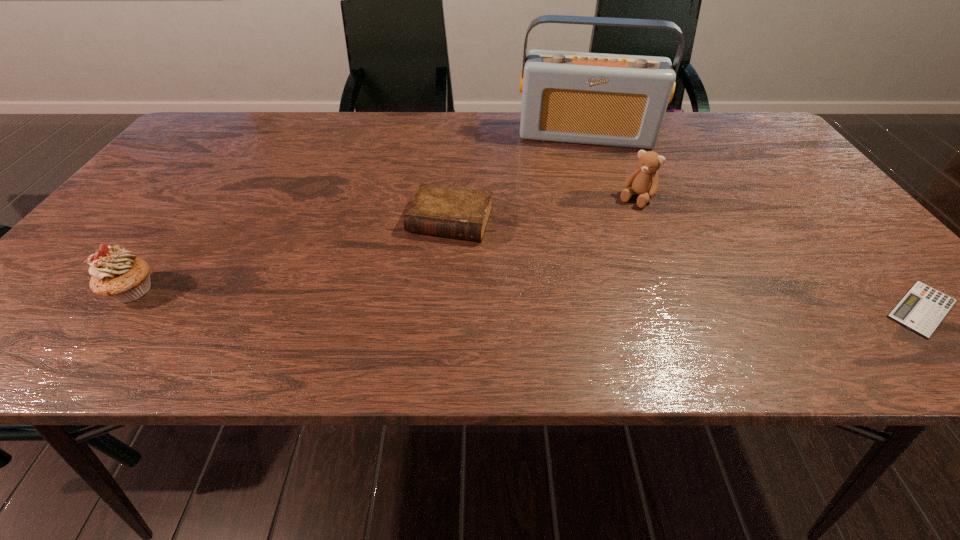
Locate an element on the screen. This screenshot has width=960, height=540. the leftmost object is located at coordinates (117, 273).

Where is `the tallest object`? This screenshot has width=960, height=540. the tallest object is located at coordinates (617, 100).

Locate an element on the screen. The image size is (960, 540). the farthest object is located at coordinates (617, 100).

I want to click on teddy bear, so click(x=643, y=181).

What are the coordinates of `diary` in the screenshot? It's located at (462, 213).

The width and height of the screenshot is (960, 540). I want to click on the second object from left to right, so click(462, 213).

This screenshot has width=960, height=540. What are the coordinates of `free space located on the right of the leftmost object` in the screenshot? It's located at (188, 291).

Image resolution: width=960 pixels, height=540 pixels. I want to click on vacant area located on the front-facing side of the farthest object, so click(579, 211).

The image size is (960, 540). In order to click on free space located 0.290m on the front-facing side of the farthest object in this screenshot , I will do `click(579, 216)`.

The width and height of the screenshot is (960, 540). Identify the location of free region located 0.270m on the front-facing side of the farthest object. (579, 211).